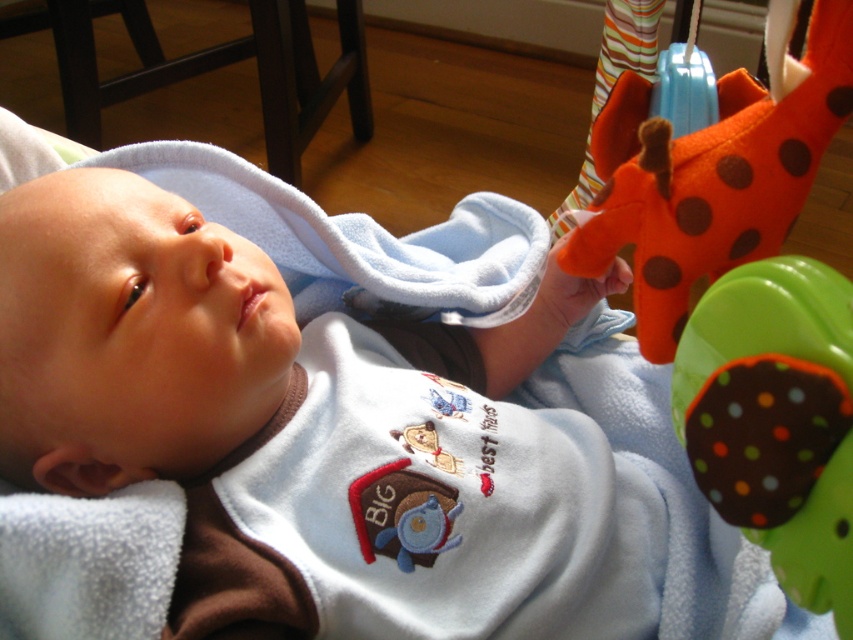
Can you confirm if green fabric teether at right is positioned above orange felt giraffe at upper right?

No.

Who is more forward, (827, 326) or (730, 76)?

Point (827, 326)

I want to click on green fabric teether at right, so click(x=776, y=419).

Where is `soft blue blanket at center`? soft blue blanket at center is located at coordinates (309, 432).

Between point (241, 332) and point (851, 86), which one is positioned in front?

Point (851, 86) is more forward.

Does point (294, 604) come farther from viewer compared to point (833, 0)?

Yes, it is behind point (833, 0).

Locate an element on the screen. soft blue blanket at center is located at coordinates (309, 432).

Who is more forward, [480,385] or [810,592]?

Point [810,592]

Does soft blue blanket at center appear on the right side of green fabric teether at right?

No, soft blue blanket at center is not to the right of green fabric teether at right.

At what (x,y) coordinates should I click in order to perform the action: click on soft blue blanket at center. Please return your answer as a coordinate pair (x, y). Looking at the image, I should click on (309, 432).